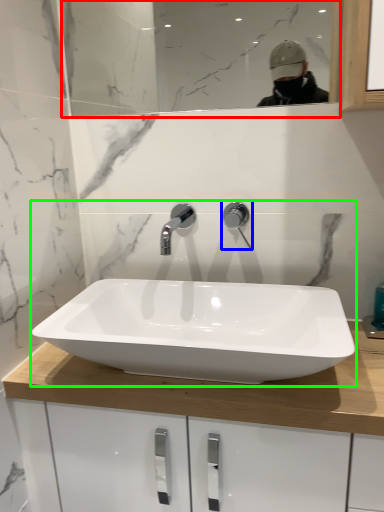
Question: Considering the real-world distances, which object is farthest from mirror (highlighted by a red box)? tap (highlighted by a blue box) or sink (highlighted by a green box)?

Choices:
 (A) tap
 (B) sink

Answer: (A)